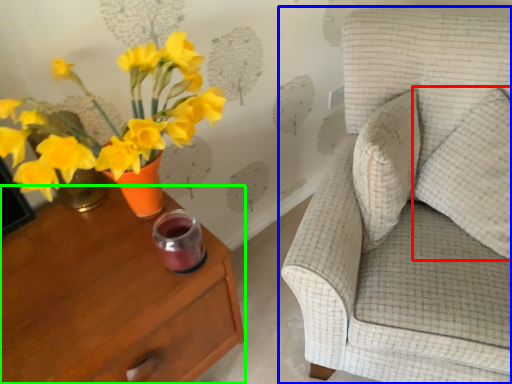
Question: Based on their relative distances, which object is nearer to pillow (highlighted by a red box)? Choose from chair (highlighted by a blue box) and nightstand (highlighted by a green box).

Choices:
 (A) chair
 (B) nightstand

Answer: (A)